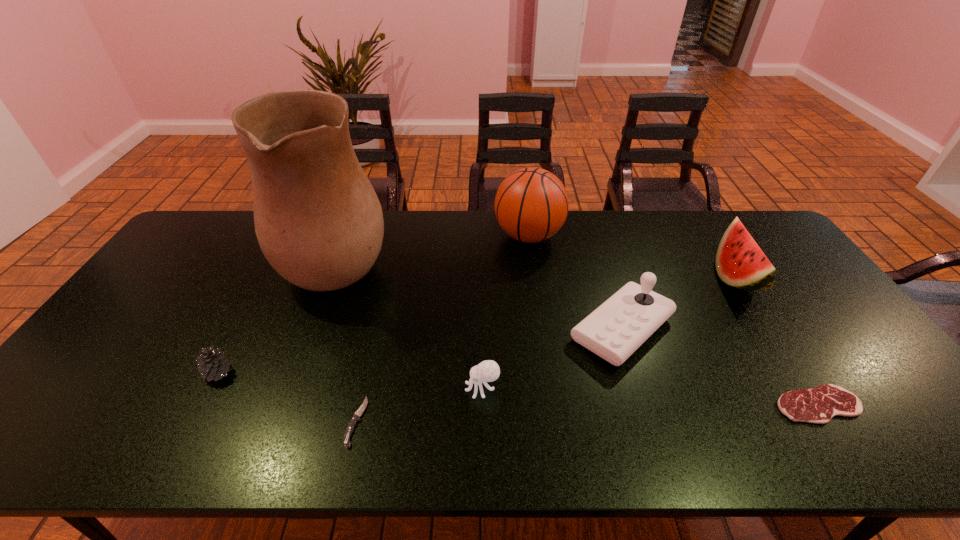
You are a GUI agent. You are given a task and a screenshot of the screen. Output one action in this format:
    pyautogui.click(x=<x>, y=<y>)
    Task: Click on the vacant space located on the outer rind of the watermelon
    This screenshot has width=960, height=540.
    Given the screenshot: What is the action you would take?
    pyautogui.click(x=632, y=278)

Locate an element on the screen. vacant space situated on the outer rind of the watermelon is located at coordinates (619, 278).

Identify the location of free point located on the outer rind of the watermelon. (677, 278).

Locate an element on the screen. The width and height of the screenshot is (960, 540). vacant region located 0.370m on the right of the joystick is located at coordinates (811, 329).

Identify the location of free space located 0.150m on the front-facing side of the fourth object from left to right. (403, 388).

I want to click on free space located on the front-facing side of the fourth object from left to right, so click(408, 388).

You are a GUI agent. You are given a task and a screenshot of the screen. Output one action in this format:
    pyautogui.click(x=<x>, y=<y>)
    Task: Click on the vacant space situated 0.400m on the front-facing side of the fourth object from left to right
    
    Given the screenshot: What is the action you would take?
    [300, 388]

Where is `free point located on the left of the pinecone`? free point located on the left of the pinecone is located at coordinates (185, 373).

You are a GUI agent. You are given a task and a screenshot of the screen. Output one action in this format:
    pyautogui.click(x=<x>, y=<y>)
    Task: Click on the vacant space located 0.180m on the back of the steak
    
    Given the screenshot: What is the action you would take?
    pyautogui.click(x=770, y=330)

This screenshot has height=540, width=960. Identify the location of vacant point located 0.070m on the left of the pocketknife. (317, 422).